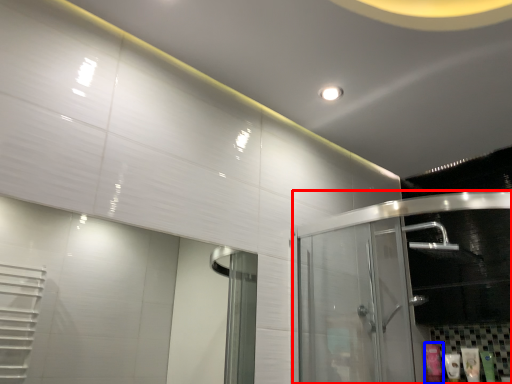
Question: Which of the following is the farthest to the observer, glass door (highlighted by a red box) or toiletry (highlighted by a blue box)?

Choices:
 (A) glass door
 (B) toiletry

Answer: (B)